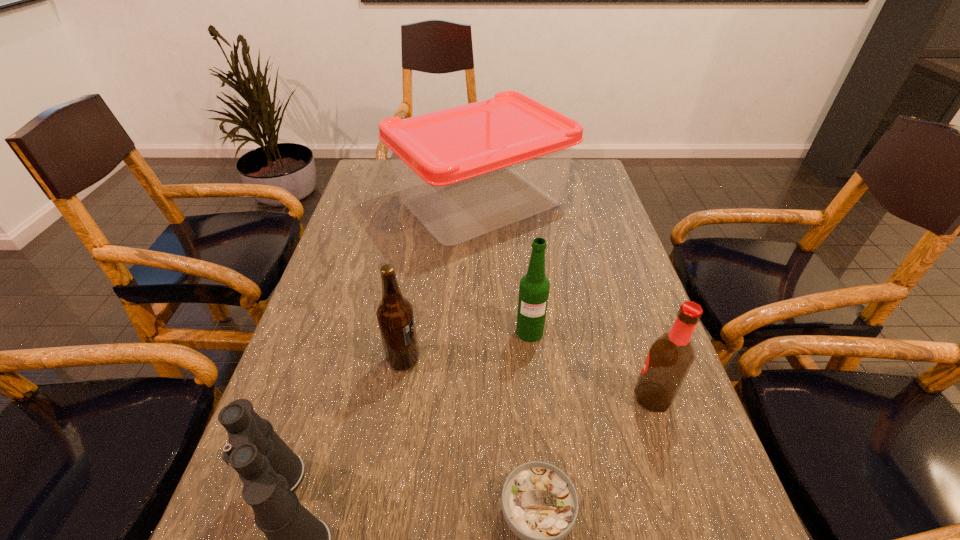
Locate an element on the screen. The image size is (960, 540). tray is located at coordinates [x=465, y=171].

Where is `the leftmost beer bottle`? the leftmost beer bottle is located at coordinates (395, 316).

Find the location of a particular element. The width and height of the screenshot is (960, 540). the second farthest beer bottle is located at coordinates (395, 316).

The height and width of the screenshot is (540, 960). I want to click on the second farthest object, so click(x=534, y=288).

This screenshot has height=540, width=960. Identify the location of the second beer bottle from right to left. (534, 288).

This screenshot has height=540, width=960. I want to click on the nearest beer bottle, so click(x=670, y=357).

This screenshot has height=540, width=960. I want to click on the rightmost object, so click(670, 357).

This screenshot has width=960, height=540. I want to click on blank space located on the front of the farthest object, so click(480, 374).

Locate an element on the screen. This screenshot has width=960, height=540. vacant space located 0.160m on the label of the second nearest beer bottle is located at coordinates (495, 359).

You are a GUI agent. You are given a task and a screenshot of the screen. Output one action in this format:
    pyautogui.click(x=<x>, y=<y>)
    Task: Click on the free space located on the label of the farthest beer bottle
    This screenshot has height=540, width=960.
    Given the screenshot: What is the action you would take?
    pyautogui.click(x=534, y=369)